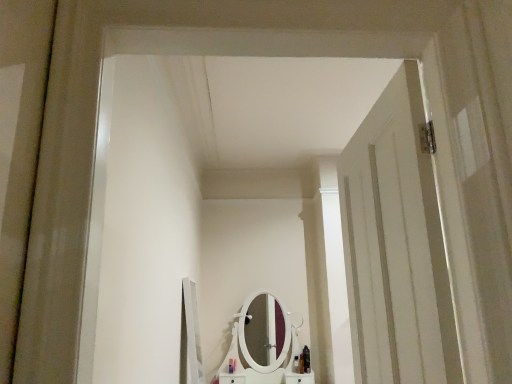
Question: From the image's perspective, is translucent plastic bottle at center, positioned as the 5th toiletry in right-to-left order, above white wooden door at right?

Choices:
 (A) no
 (B) yes

Answer: (A)

Question: Can you confirm if translucent plastic bottle at center, positioned as the 5th toiletry in right-to-left order, is thinner than white wooden door at right?

Choices:
 (A) yes
 (B) no

Answer: (A)

Question: Would you consider translucent plastic bottle at center, positioned as the 5th toiletry in right-to-left order, to be distant from white wooden door at right?

Choices:
 (A) no
 (B) yes

Answer: (B)

Question: Is translucent plastic bottle at center, placed as the 1th toiletry when sorted from left to right, bigger than white wooden door at right?

Choices:
 (A) no
 (B) yes

Answer: (A)

Question: Does translucent plastic bottle at center, placed as the 1th toiletry when sorted from left to right, have a lesser height compared to white wooden door at right?

Choices:
 (A) no
 (B) yes

Answer: (B)

Question: From the image's perspective, is shiny black bottle at lower center, the 5th toiletry viewed from the left, positioned above or below white wooden door at right?

Choices:
 (A) above
 (B) below

Answer: (B)

Question: Considering the positions of point (305, 367) and point (373, 198), is point (305, 367) closer or farther from the camera than point (373, 198)?

Choices:
 (A) closer
 (B) farther

Answer: (B)

Question: From a real-world perspective, is shiny black bottle at lower center, the 5th toiletry viewed from the left, positioned above or below white wooden door at right?

Choices:
 (A) above
 (B) below

Answer: (B)

Question: In terms of width, does shiny black bottle at lower center, the 5th toiletry viewed from the left, look wider or thinner when compared to white wooden door at right?

Choices:
 (A) thin
 (B) wide

Answer: (A)

Question: From a real-world perspective, is shiny black bottle at lower center, the 5th toiletry viewed from the left, positioned above or below translucent plastic bottle at center, marked as the 3th toiletry in a right-to-left arrangement?

Choices:
 (A) above
 (B) below

Answer: (A)

Question: In terms of width, does shiny black bottle at lower center, which appears as the first toiletry when viewed from the right, look wider or thinner when compared to translucent plastic bottle at center, marked as the 3th toiletry in a right-to-left arrangement?

Choices:
 (A) wide
 (B) thin

Answer: (A)

Question: In terms of height, does shiny black bottle at lower center, the 5th toiletry viewed from the left, look taller or shorter compared to translucent plastic bottle at center, the 3th toiletry from the left?

Choices:
 (A) tall
 (B) short

Answer: (A)

Question: In terms of size, does shiny black bottle at lower center, the 5th toiletry viewed from the left, appear bigger or smaller than translucent plastic bottle at center, marked as the 3th toiletry in a right-to-left arrangement?

Choices:
 (A) big
 (B) small

Answer: (A)

Question: Is point (437, 344) positioned closer to the camera than point (298, 370)?

Choices:
 (A) farther
 (B) closer

Answer: (B)

Question: In the image, is white wooden door at right positioned in front of or behind shiny black bottle at center, which appears as the 2th toiletry when viewed from the right?

Choices:
 (A) front
 (B) behind

Answer: (A)